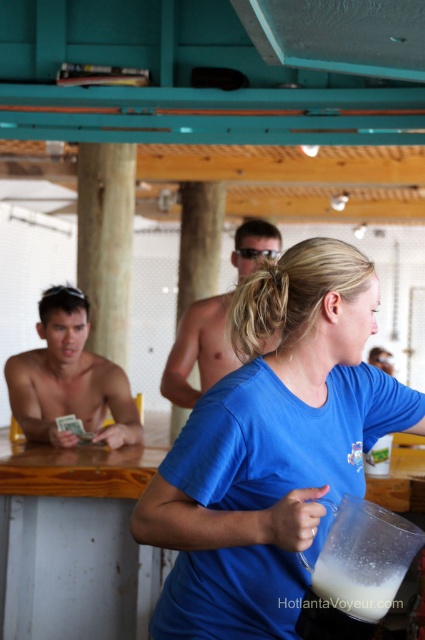
From the picture: Measure the distance between point (200, 616) and camera.

Point (200, 616) is 5.55 feet from camera.

At what (x,y) coordinates should I click in order to perform the action: click on blue fabric shirt at center. Please return your answer as a coordinate pair (x, y). This screenshot has height=640, width=425. Looking at the image, I should click on (272, 448).

Image resolution: width=425 pixels, height=640 pixels. I want to click on blue fabric shirt at center, so click(272, 448).

Measure the distance between blue fabric shirt at center and camera.

A distance of 1.54 meters exists between blue fabric shirt at center and camera.

Is blue fabric shirt at center bigger than shiny metallic shirt at center?

No.

Describe the element at coordinates (272, 448) in the screenshot. This screenshot has width=425, height=640. I see `blue fabric shirt at center` at that location.

At what (x,y) coordinates should I click in order to perform the action: click on blue fabric shirt at center. Please return your answer as a coordinate pair (x, y). Image resolution: width=425 pixels, height=640 pixels. Looking at the image, I should click on (272, 448).

Who is more distant from viewer, (314, 445) or (61, 444)?

The point (61, 444) is more distant.

Is blue fabric shirt at center shorter than shiny skin torso at left?

No.

Which is in front, point (180, 483) or point (82, 371)?

Positioned in front is point (180, 483).

Where is `blue fabric shirt at center`? The width and height of the screenshot is (425, 640). blue fabric shirt at center is located at coordinates (272, 448).